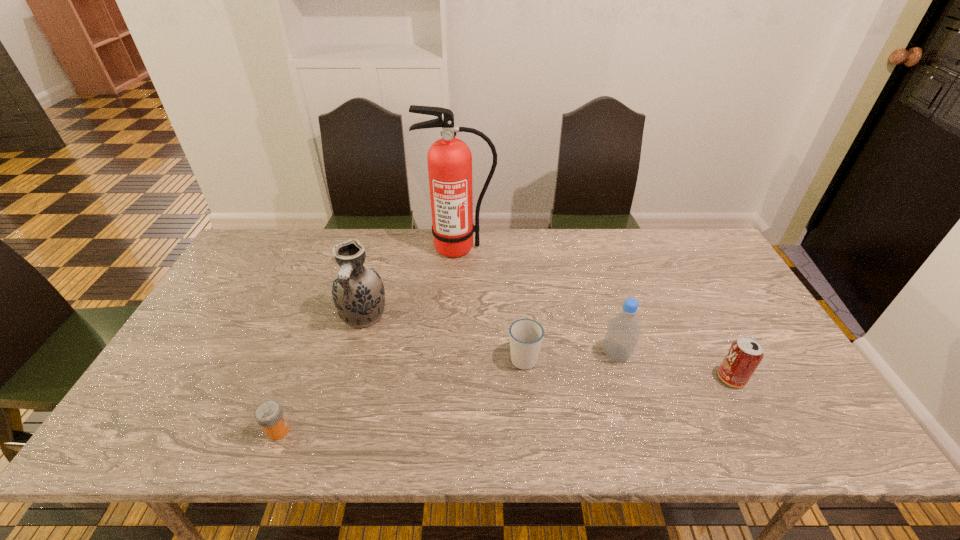
This screenshot has height=540, width=960. I want to click on object that is positioned at the right edge, so click(745, 354).

The width and height of the screenshot is (960, 540). In order to click on vacant region at the far edge in this screenshot , I will do `click(383, 234)`.

I want to click on vacant space at the near edge of the desktop, so click(465, 449).

Identify the location of vacant space at the left edge of the desktop. pos(259,287).

This screenshot has height=540, width=960. Find the location of `vacant space at the right edge`. vacant space at the right edge is located at coordinates (742, 294).

Find the location of `vacant area at the far left corner`. vacant area at the far left corner is located at coordinates (274, 229).

The image size is (960, 540). Identify the location of vacant area that lies between the fourth object from left to right and the bottle. (570, 356).

Find the location of a particular element. The width and height of the screenshot is (960, 540). free space between the rightmost object and the cup is located at coordinates (628, 368).

Where is `empty location between the fourth object from right to left and the third object from right to left`? The width and height of the screenshot is (960, 540). empty location between the fourth object from right to left and the third object from right to left is located at coordinates (491, 302).

I want to click on vacant space in between the leftmost object and the vase, so click(x=321, y=373).